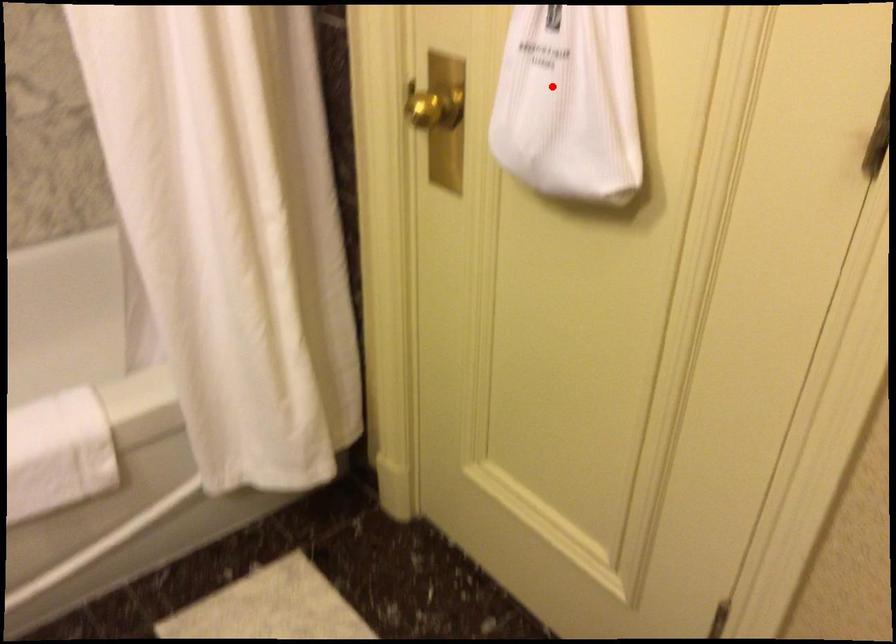
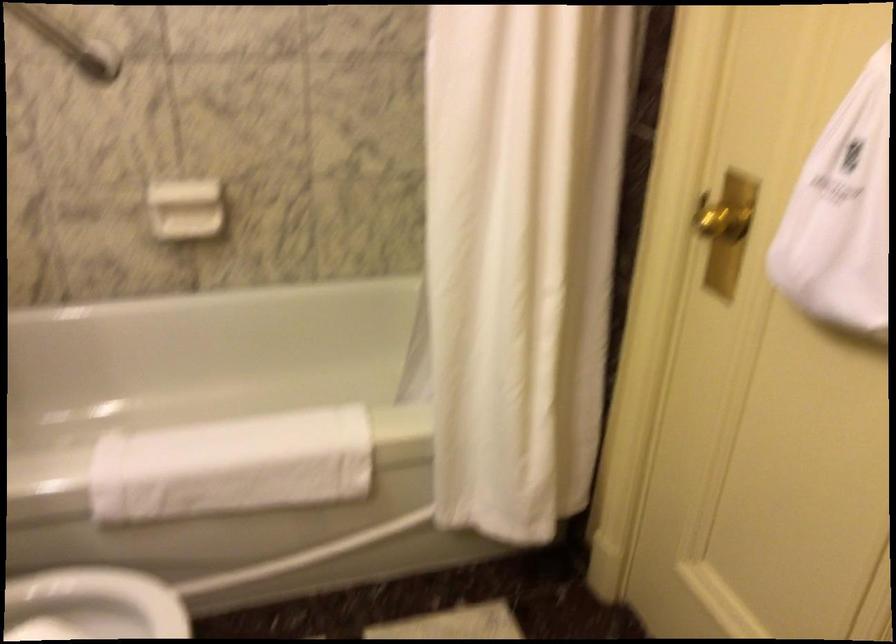
Locate, in the second image, the point that corresponds to the highlighted location in the first image.

(841, 214)